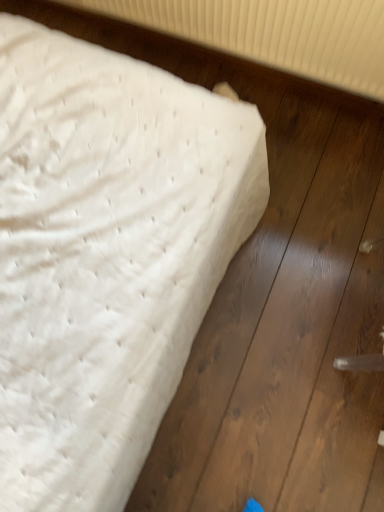
Question: Would you say white quilted mattress at upper left is part of white textured radiator at upper center's contents?

Choices:
 (A) yes
 (B) no

Answer: (B)

Question: Would you say white textured radiator at upper center is outside white quilted mattress at upper left?

Choices:
 (A) yes
 (B) no

Answer: (A)

Question: Does white textured radiator at upper center have a larger size compared to white quilted mattress at upper left?

Choices:
 (A) yes
 (B) no

Answer: (B)

Question: Is white textured radiator at upper center turned away from white quilted mattress at upper left?

Choices:
 (A) no
 (B) yes

Answer: (A)

Question: Is white textured radiator at upper center positioned in front of white quilted mattress at upper left?

Choices:
 (A) no
 (B) yes

Answer: (A)

Question: Does white textured radiator at upper center have a lesser height compared to white quilted mattress at upper left?

Choices:
 (A) yes
 (B) no

Answer: (B)

Question: Could white textured radiator at upper center be considered to be inside white quilted mattress at upper left?

Choices:
 (A) no
 (B) yes

Answer: (A)

Question: Is white quilted mattress at upper left bigger than white textured radiator at upper center?

Choices:
 (A) no
 (B) yes

Answer: (B)

Question: Is white quilted mattress at upper left facing away from white textured radiator at upper center?

Choices:
 (A) yes
 (B) no

Answer: (B)

Question: Are white quilted mattress at upper left and white textured radiator at upper center beside each other?

Choices:
 (A) no
 (B) yes

Answer: (A)

Question: Does white quilted mattress at upper left appear on the left side of white textured radiator at upper center?

Choices:
 (A) no
 (B) yes

Answer: (B)

Question: Does white quilted mattress at upper left have a greater width compared to white textured radiator at upper center?

Choices:
 (A) yes
 (B) no

Answer: (A)

Question: Considering the positions of white textured radiator at upper center and white quilted mattress at upper left in the image, is white textured radiator at upper center wider or thinner than white quilted mattress at upper left?

Choices:
 (A) thin
 (B) wide

Answer: (A)